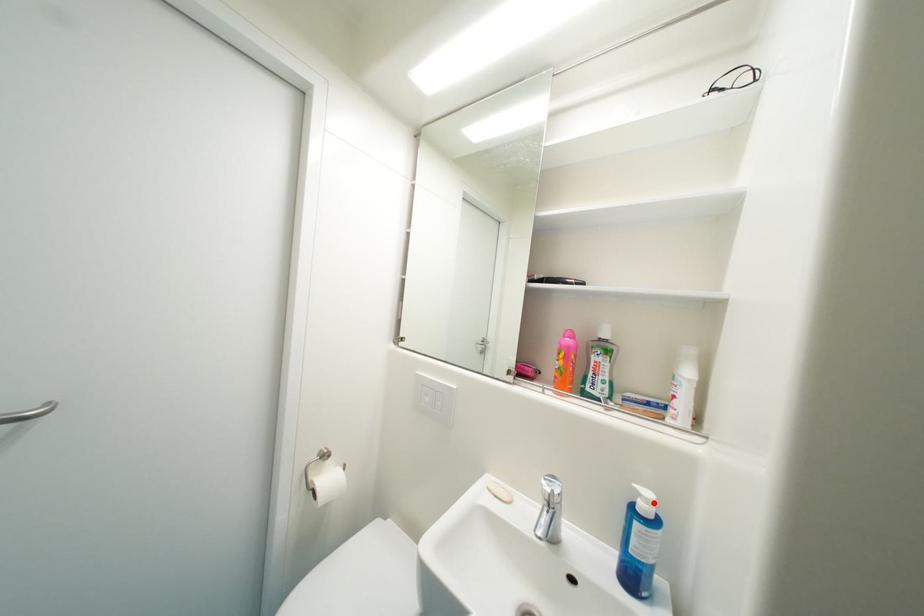
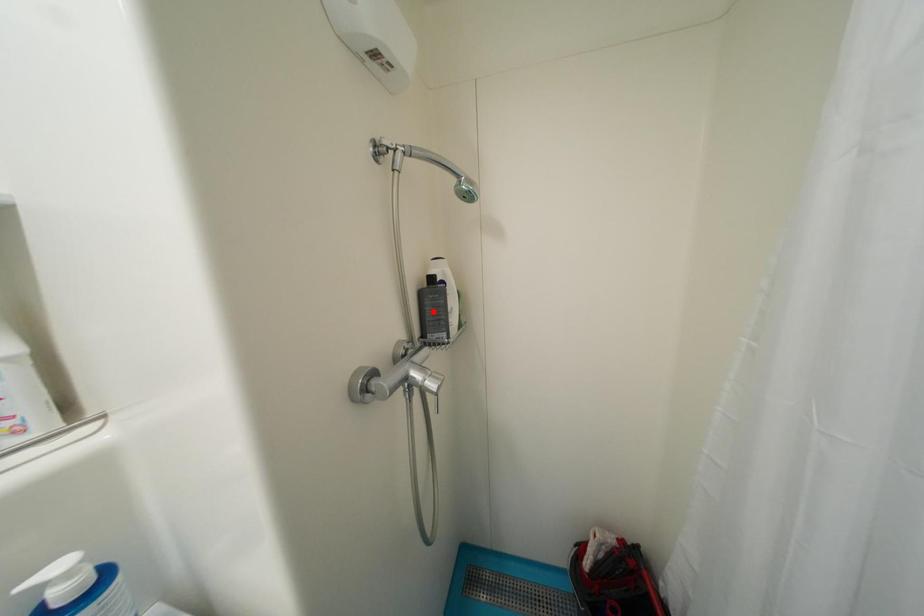
I am providing you with two images of the same scene from different viewpoints. A red point is marked on the first image and another point is marked on the second image. Do the highlighted points in image1 and image2 indicate the same real-world spot?

No